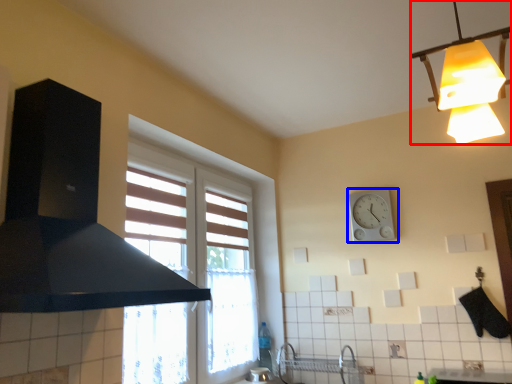
Question: Which of the following is the farthest to the observer, lamp (highlighted by a red box) or wall clock (highlighted by a blue box)?

Choices:
 (A) lamp
 (B) wall clock

Answer: (B)